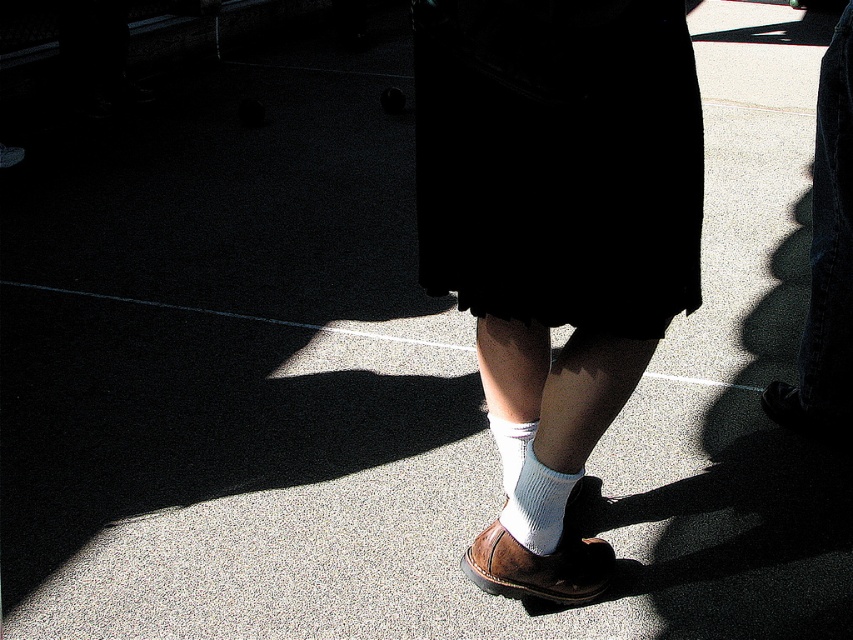
You are a fashion designer observing the closeup of the person wearing white cotton socks at center and white knitted sock at center. Which sock is longer in length?

The white cotton socks at center is much taller than the white knitted sock at center, so the white cotton socks at center is longer in length.

In the scene shown: You are a photographer adjusting the lighting for a shoot. You notice the black fabric skirt at center and the white cotton socks at center in the frame. Which item is positioned to the left of the other?

The black fabric skirt at center is positioned on the left side of white cotton socks at center.

You are a fashion designer observing the image. You need to determine which item of clothing extends higher up the leg. Which one is taller between the black fabric skirt at center and the white knitted sock at center?

The black fabric skirt at center is taller than the white knitted sock at center according to the description.